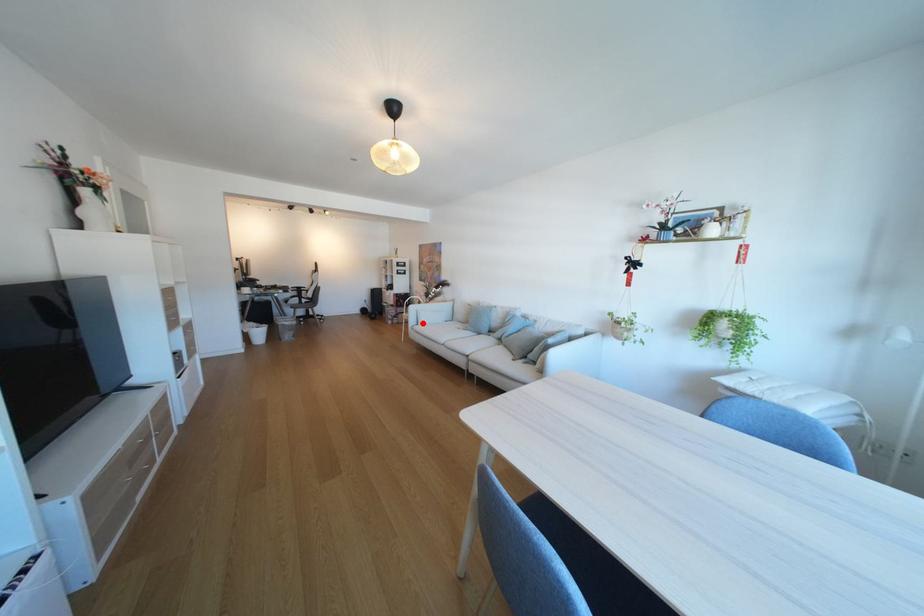
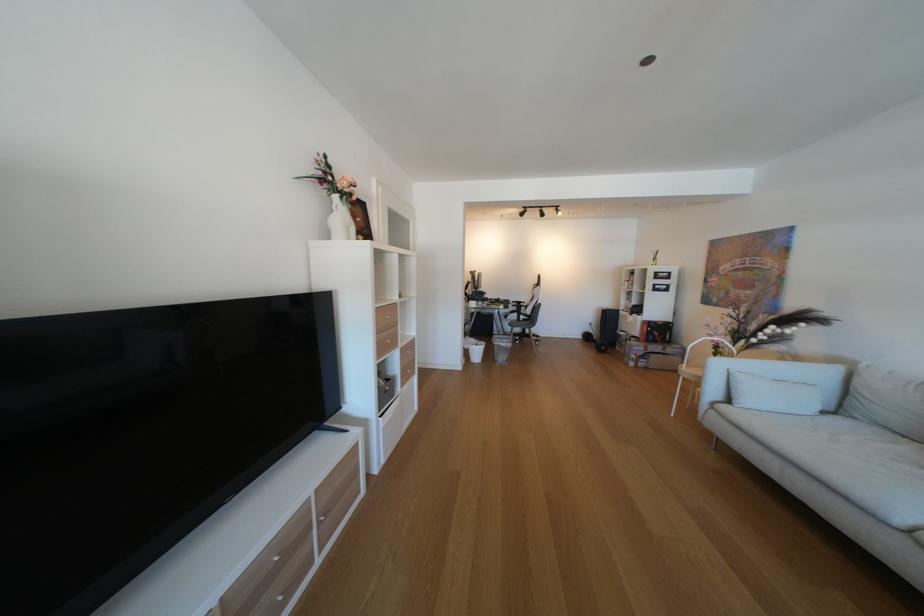
Question: I am providing you with two images of the same scene from different viewpoints. Image1 has a red point marked. In image2, the corresponding 3D location appears at what relative position? Reply with the corresponding letter.

Choices:
 (A) Closer
 (B) Farther

Answer: (A)